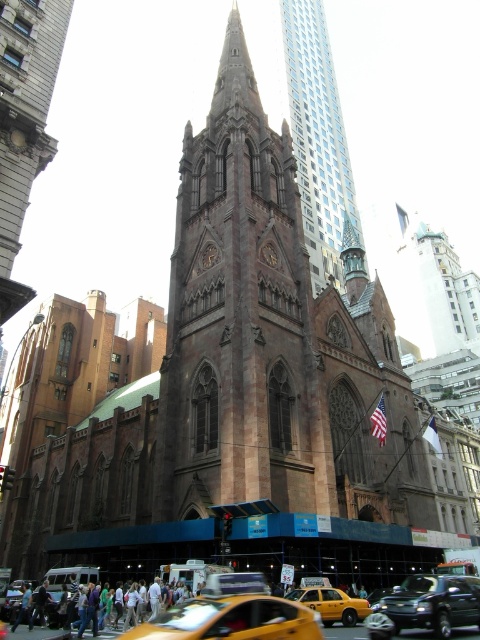
Question: Can you confirm if brown stone tower at center is thinner than yellow matte taxi at lower center?

Choices:
 (A) no
 (B) yes

Answer: (A)

Question: Is glassy steel skyscraper at upper center bigger than shiny black sedan at center?

Choices:
 (A) no
 (B) yes

Answer: (B)

Question: Which of the following is the closest to the observer?

Choices:
 (A) click(x=178, y=218)
 (B) click(x=292, y=65)

Answer: (A)

Question: Is brown stone tower at center behind yellow matte taxi at center?

Choices:
 (A) yes
 (B) no

Answer: (A)

Question: Which of the following is the closest to the observer?

Choices:
 (A) shiny black sedan at center
 (B) yellow matte taxi at lower center

Answer: (B)

Question: Among these points, which one is nearest to the camera?

Choices:
 (A) (157, 438)
 (B) (304, 120)
 (C) (312, 595)
 (D) (275, 600)

Answer: (D)